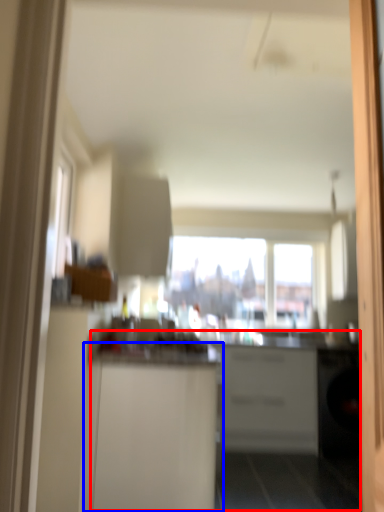
Question: Which object appears farthest to the camera in this image, counter (highlighted by a red box) or cabinetry (highlighted by a blue box)?

Choices:
 (A) counter
 (B) cabinetry

Answer: (B)